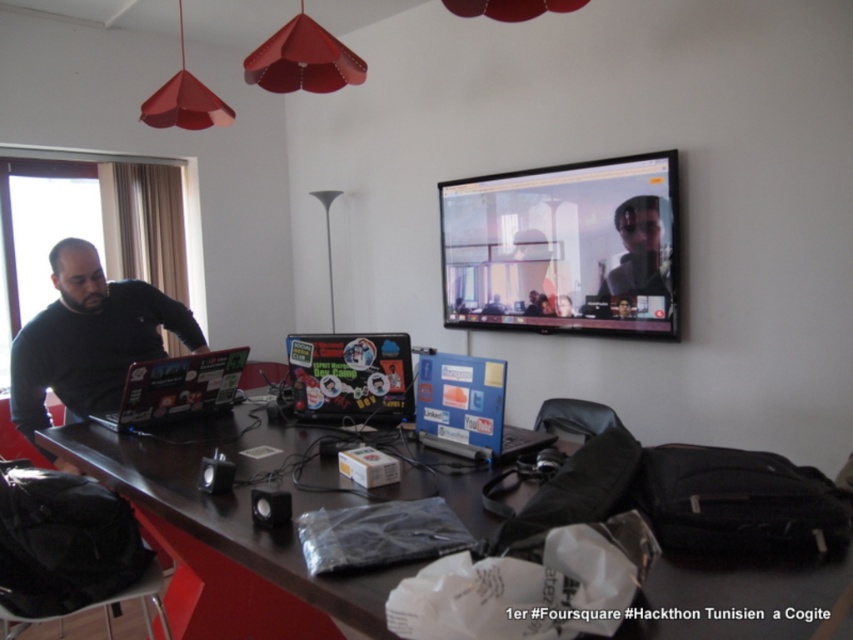
Can you confirm if shiny black laptop at left is positioned to the right of matte black shirt at upper center?

No, shiny black laptop at left is not to the right of matte black shirt at upper center.

Between shiny black laptop at left and matte black shirt at upper center, which one has less height?

shiny black laptop at left

Describe the element at coordinates (177, 388) in the screenshot. The width and height of the screenshot is (853, 640). I see `shiny black laptop at left` at that location.

Where is `shiny black laptop at left`? The width and height of the screenshot is (853, 640). shiny black laptop at left is located at coordinates (177, 388).

Does matte black laptop at left appear under blue matte laptop at center?

No.

Does point (148, 288) lie behind point (498, 365)?

Yes, point (148, 288) is farther from viewer.

The height and width of the screenshot is (640, 853). I want to click on matte black laptop at left, so 90,339.

Does point (57, 384) come farther from viewer compared to point (401, 408)?

Yes, it is behind point (401, 408).

Which is below, matte black laptop at left or stickered matte laptop at center?

Positioned lower is stickered matte laptop at center.

Locate an element on the screen. The image size is (853, 640). matte black laptop at left is located at coordinates (90, 339).